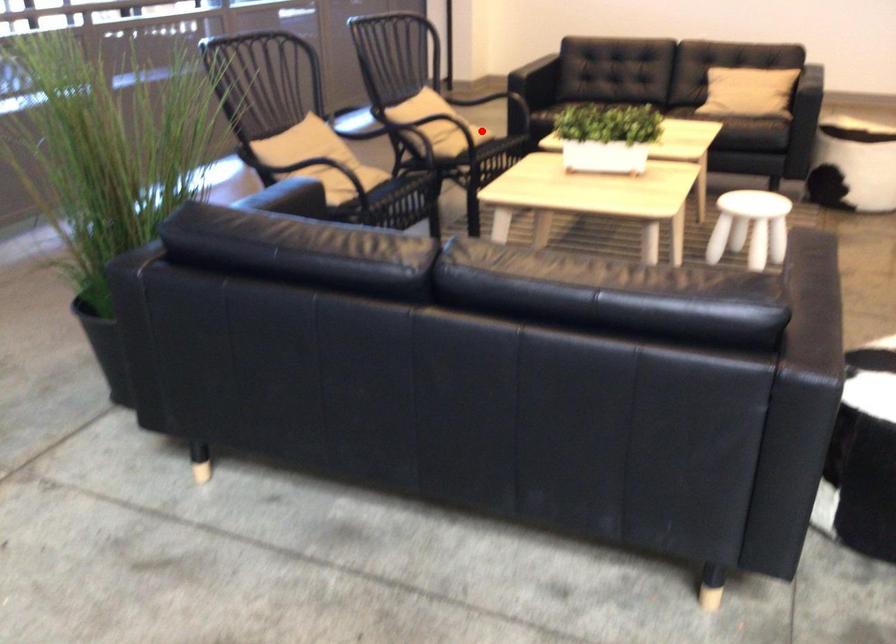
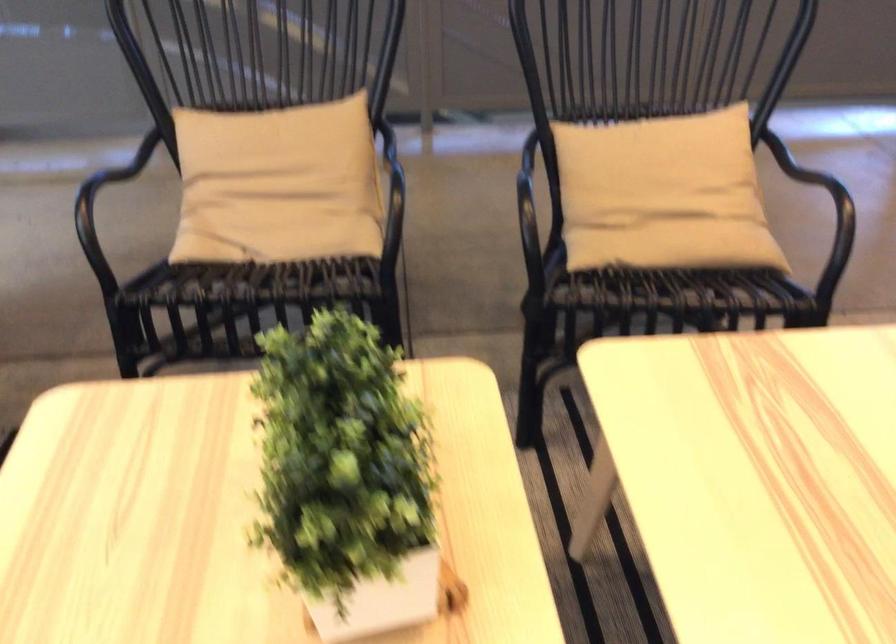
Question: I am providing you with two images of the same scene from different viewpoints. A red point is shown in image1. For the corresponding object point in image2, is it positioned nearer or farther from the camera?

Choices:
 (A) Nearer
 (B) Farther

Answer: (A)